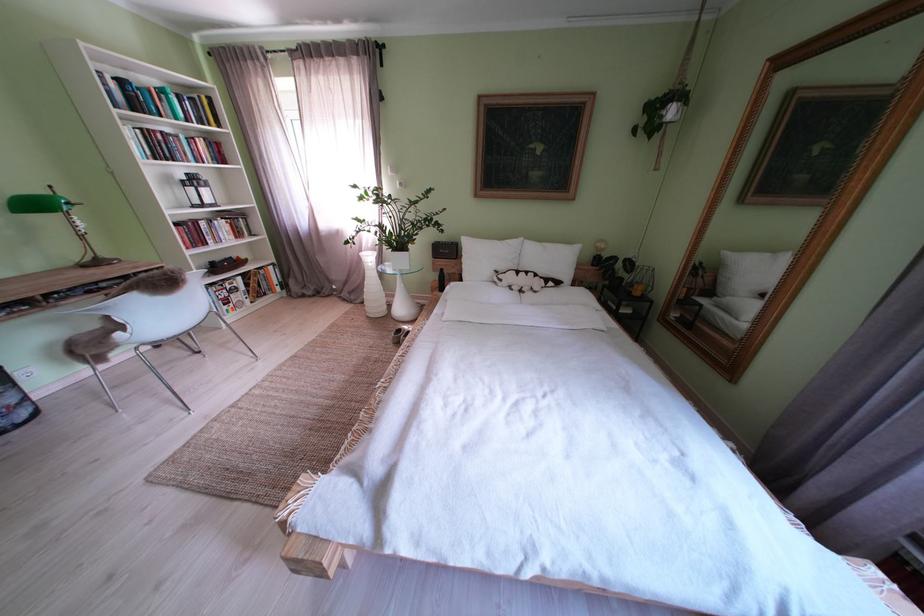
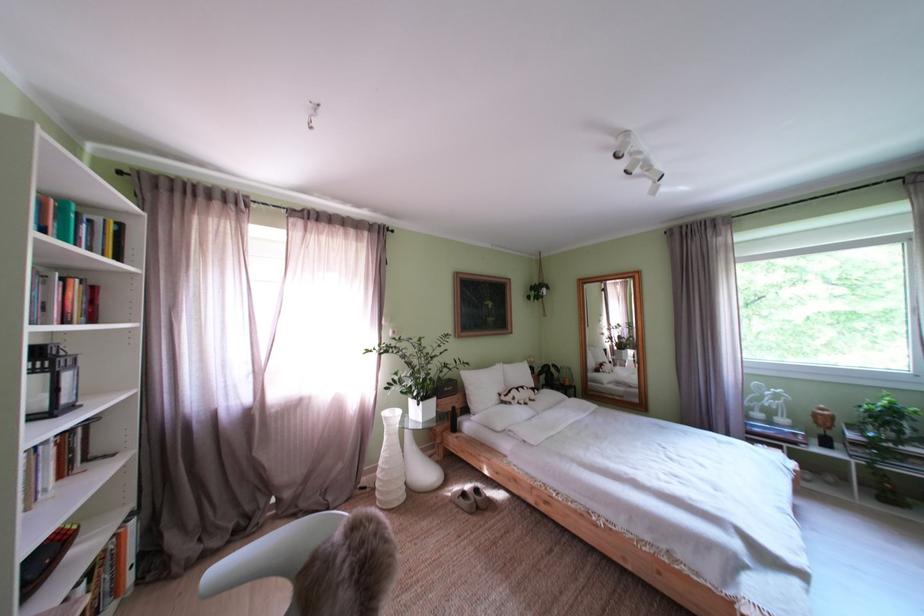
Where in the second image is the point corresponding to (x=546, y=294) from the first image?

(543, 403)